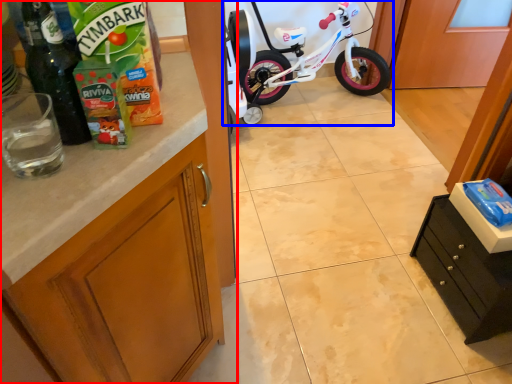
Question: Among these objects, which one is farthest to the camera, cabinetry (highlighted by a red box) or bicycle (highlighted by a blue box)?

Choices:
 (A) cabinetry
 (B) bicycle

Answer: (B)